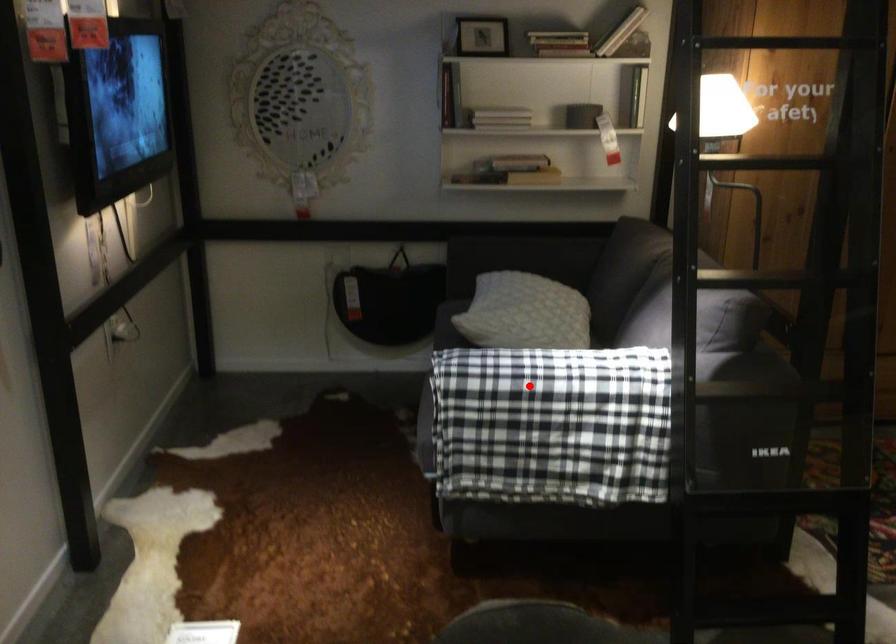
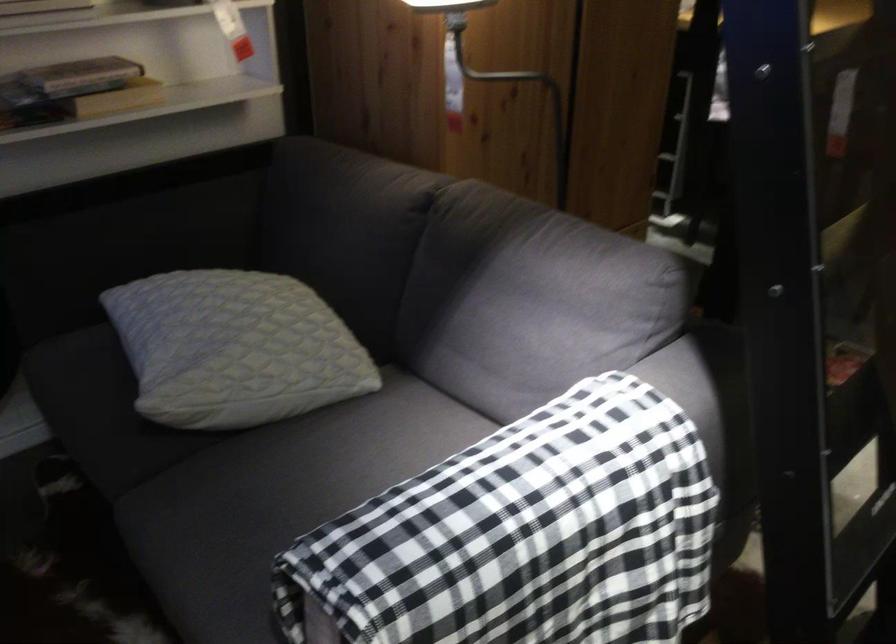
The point at the highlighted location is marked in the first image. Where is the corresponding point in the second image?

(522, 536)